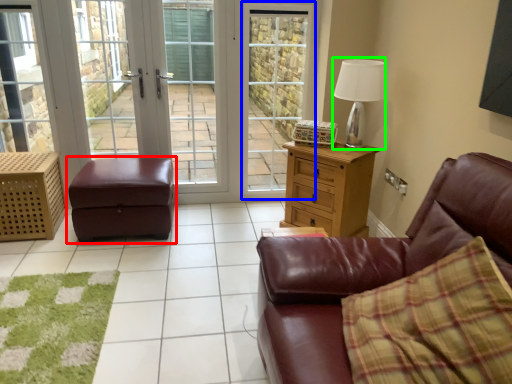
Question: Estimate the real-world distances between objects in this image. Which object is farther from table (highlighted by a red box), screen door (highlighted by a blue box) or table lamp (highlighted by a green box)?

Choices:
 (A) screen door
 (B) table lamp

Answer: (B)